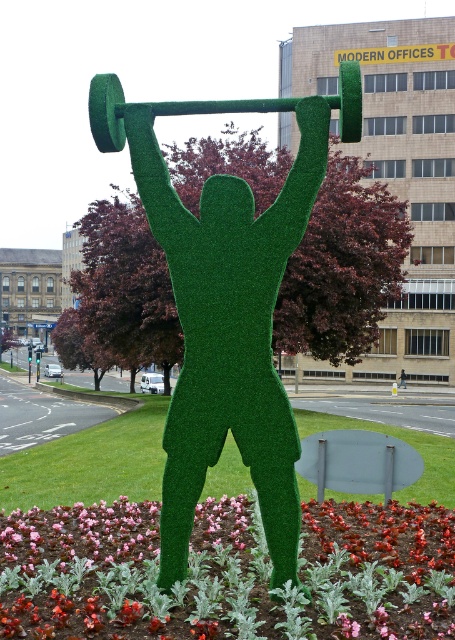
Which is below, pink fabric flower at center or green grassy figure at center?

pink fabric flower at center is below.

Does pink fabric flower at center have a smaller size compared to green grassy figure at center?

No.

Does point (249, 576) come in front of point (303, 198)?

That is False.

Image resolution: width=455 pixels, height=640 pixels. Find the location of `pink fabric flower at center`. pink fabric flower at center is located at coordinates (227, 573).

Is pink fabric flower at center further to the viewer compared to green grassy barbell at upper center?

No, pink fabric flower at center is in front of green grassy barbell at upper center.

Image resolution: width=455 pixels, height=640 pixels. What are the coordinates of `pink fabric flower at center` in the screenshot? It's located at (227, 573).

What do you see at coordinates (227, 573) in the screenshot? This screenshot has height=640, width=455. I see `pink fabric flower at center` at bounding box center [227, 573].

The height and width of the screenshot is (640, 455). In order to click on pink fabric flower at center in this screenshot , I will do `click(227, 573)`.

Does green grassy figure at center have a smaller size compared to green grassy barbell at upper center?

Correct, green grassy figure at center occupies less space than green grassy barbell at upper center.

In the scene shown: Which is above, green grassy figure at center or green grassy barbell at upper center?

green grassy barbell at upper center is above.

Is point (217, 362) positioned before point (348, 118)?

Yes, point (217, 362) is in front of point (348, 118).

Locate an element on the screen. green grassy figure at center is located at coordinates (228, 332).